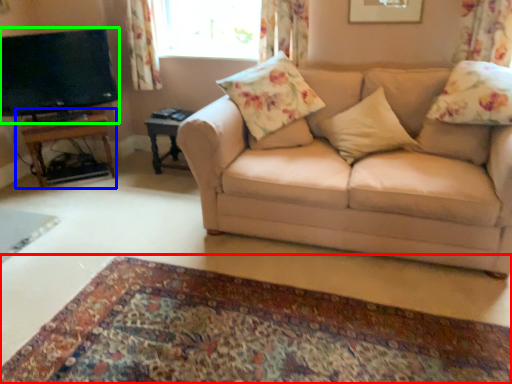
Question: Based on their relative distances, which object is farther from plain (highlighted by a red box)? Choose from table (highlighted by a blue box) and television (highlighted by a green box).

Choices:
 (A) table
 (B) television

Answer: (B)